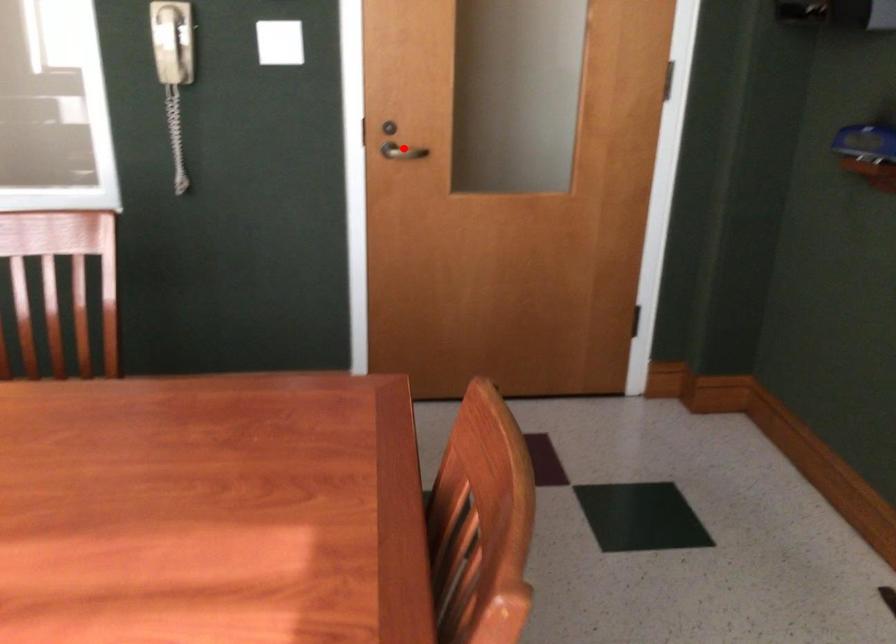
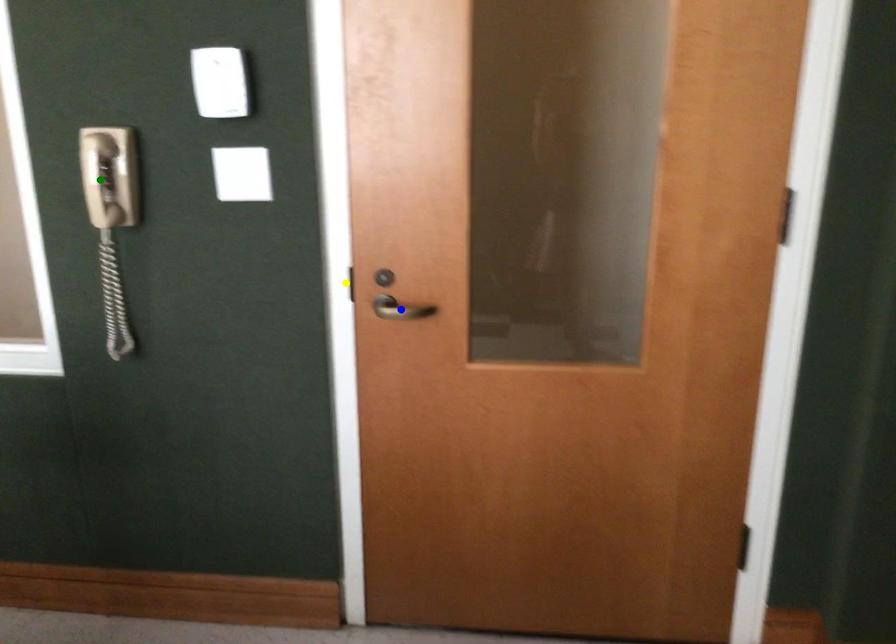
Question: I am providing you with two images of the same scene from different viewpoints. A red point is marked on the first image. You are given multiple points on the second image. Which point in image 2 represents the same 3d spot as the red point in image 1?

Choices:
 (A) yellow point
 (B) blue point
 (C) green point

Answer: (B)